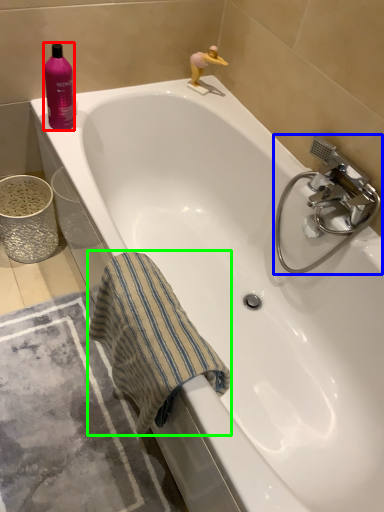
Question: Based on their relative distances, which object is nearer to cleaning product (highlighted by a red box)? Choose from tap (highlighted by a blue box) and beach towel (highlighted by a green box).

Choices:
 (A) tap
 (B) beach towel

Answer: (B)